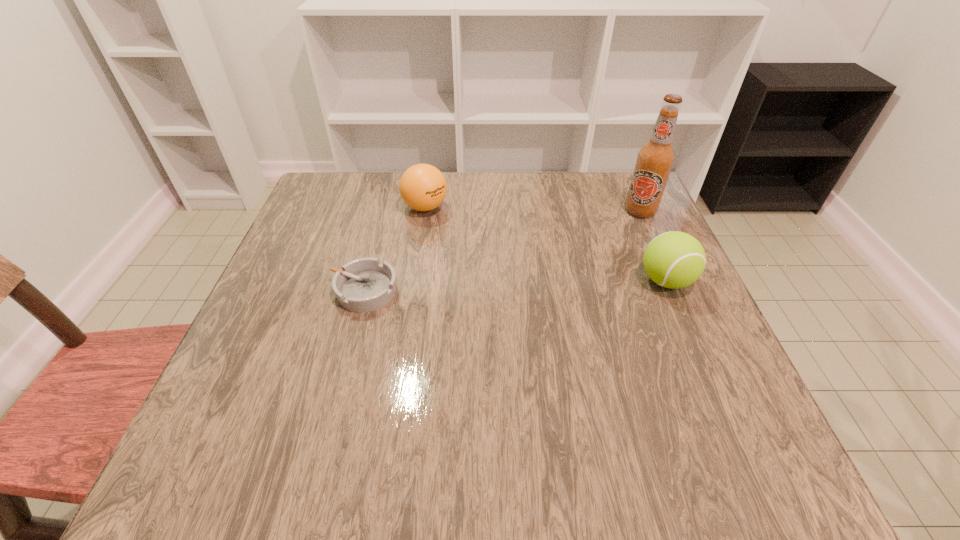
Locate an element on the screen. the shortest object is located at coordinates (363, 285).

Locate an element on the screen. This screenshot has width=960, height=540. tennis ball is located at coordinates (674, 259).

Locate an element on the screen. The height and width of the screenshot is (540, 960). the tallest object is located at coordinates (655, 159).

Find the location of a particular element. The image size is (960, 540). ping-pong ball is located at coordinates (423, 187).

This screenshot has width=960, height=540. Identify the location of vacant point located 0.070m on the back of the shortest object. (375, 249).

Find the location of a particular element. vacant area located 0.050m on the back of the tennis ball is located at coordinates (652, 248).

Find the location of a particular element. The width and height of the screenshot is (960, 540). vacant space located on the front label of the tallest object is located at coordinates (596, 247).

Where is `free space located on the front label of the tallest object`? Image resolution: width=960 pixels, height=540 pixels. free space located on the front label of the tallest object is located at coordinates (532, 299).

Image resolution: width=960 pixels, height=540 pixels. In order to click on vacant point located 0.310m on the front label of the tallest object in this screenshot , I will do `click(558, 278)`.

Find the location of a particular element. vacant area located on the side with brand of the ping-pong ball is located at coordinates (458, 260).